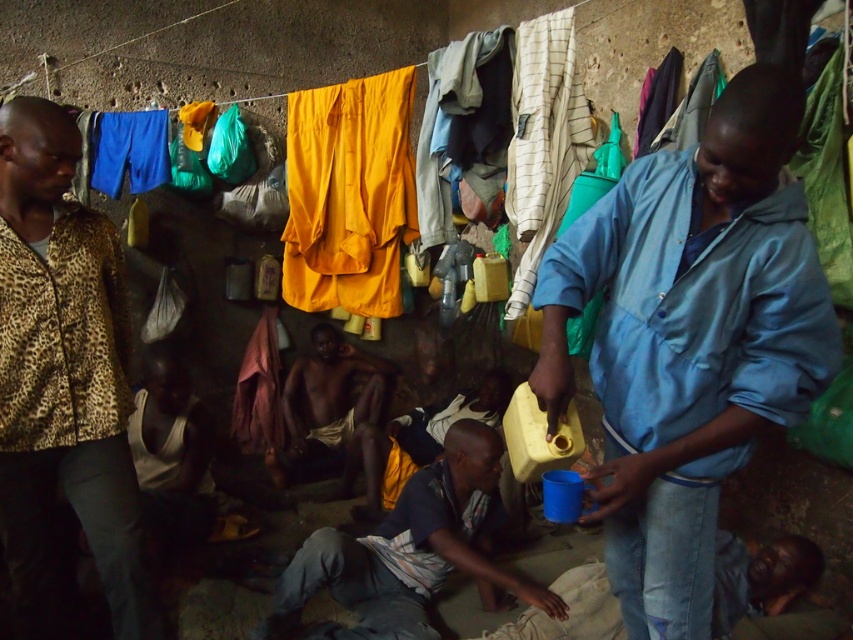
Question: Can you confirm if dark blue striped shirt at center is smaller than dark skin man at center?

Choices:
 (A) yes
 (B) no

Answer: (B)

Question: Can you confirm if leopard print jacket at left is positioned above jeans at lower right?

Choices:
 (A) no
 (B) yes

Answer: (B)

Question: Which point is farther to the camera?

Choices:
 (A) [596, 573]
 (B) [653, 618]
 (C) [119, 483]

Answer: (A)

Question: Which object appears farthest from the camera in this image?

Choices:
 (A) dark blue striped shirt at center
 (B) dark skin man at center
 (C) blue satin shirt at right
 (D) jeans at lower right

Answer: (B)

Question: Which of the following is the farthest from the observer?

Choices:
 (A) (653, 323)
 (B) (722, 529)
 (C) (335, 561)

Answer: (B)

Question: Can you confirm if leopard print jacket at left is positioned below dark skin man at center?

Choices:
 (A) no
 (B) yes

Answer: (A)